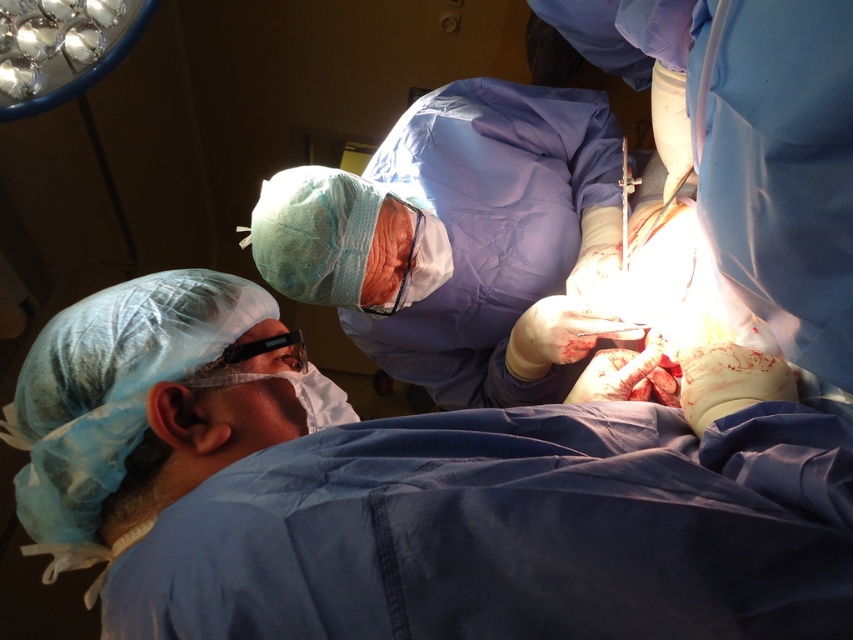
You are a medical student observing a surgery. You notice the purple smooth gown at center and the metallic silver scalpel at upper center. Which object takes up more space in the image?

The purple smooth gown at center is larger in size than the metallic silver scalpel at upper center, so it takes up more space in the image.

Consider the image. You are a medical student observing a surgery. The surgeon asks you to compare the size of the purple smooth gown at center and the metallic silver scalpel at upper center. Which object is wider?

The purple smooth gown at center is wider than the metallic silver scalpel at upper center according to the description provided.

You are a medical student observing a surgery. You notice the purple smooth gown at center and the metallic silver scalpel at upper center. Which object is closer to you from your viewpoint?

The purple smooth gown at center is closer to you because it is in front of the metallic silver scalpel at upper center.